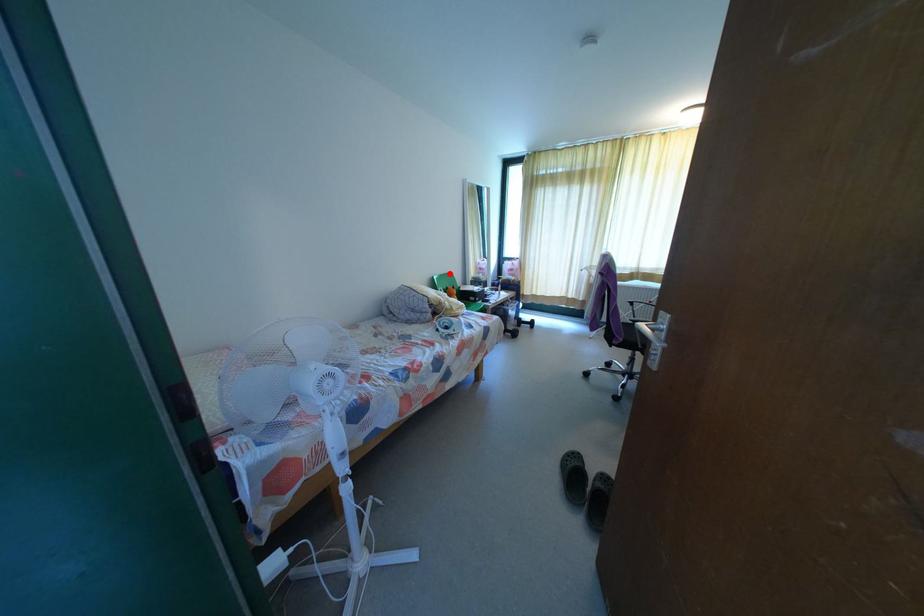
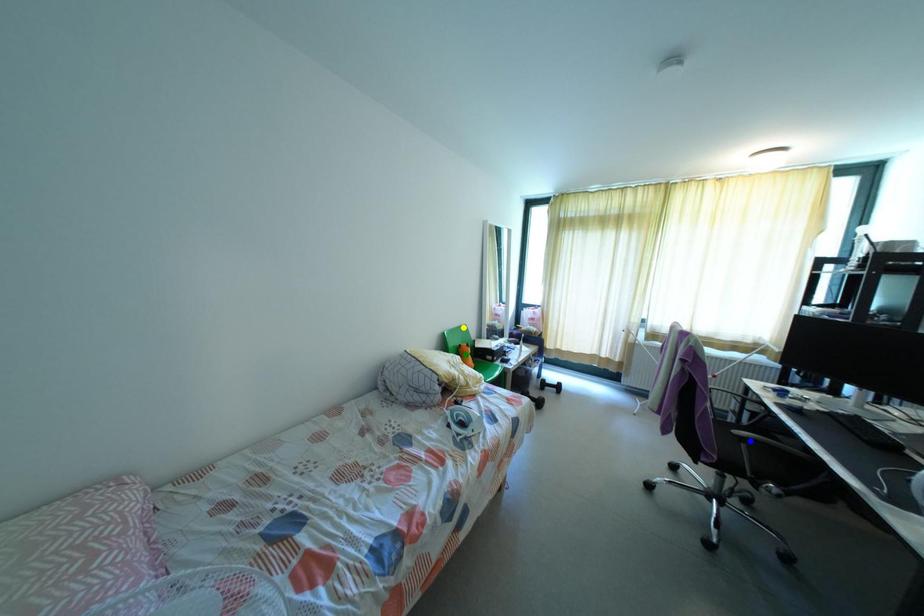
Question: I am providing you with two images of the same scene from different viewpoints. A red point is marked on the first image. You are given multiple points on the second image. In image 2, which mark is for the same physical point as the one in image 1?

Choices:
 (A) green point
 (B) yellow point
 (C) blue point

Answer: (B)